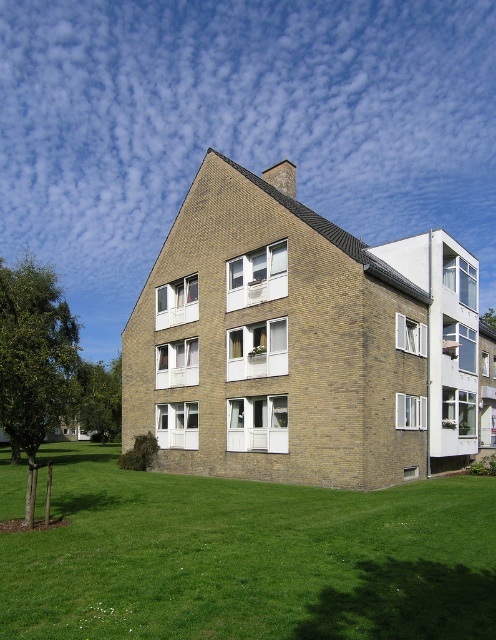
Is the position of green grass at lower center less distant than that of green leafy tree at lower left?

Yes, green grass at lower center is closer to the viewer.

Locate an element on the screen. green grass at lower center is located at coordinates (248, 557).

Where is `green grass at lower center`? green grass at lower center is located at coordinates (248, 557).

Can you confirm if green grass at lower center is positioned above green leafy tree at left?

No, green grass at lower center is not above green leafy tree at left.

Image resolution: width=496 pixels, height=640 pixels. Identify the location of green grass at lower center. (248, 557).

Which is in front, point (7, 410) or point (105, 401)?

Point (7, 410)

Does green leafy tree at left appear on the right side of green leafy tree at lower left?

In fact, green leafy tree at left is to the left of green leafy tree at lower left.

Is point (50, 340) positioned in front of point (108, 381)?

That is True.

The image size is (496, 640). In order to click on green leafy tree at left in this screenshot , I will do `click(34, 360)`.